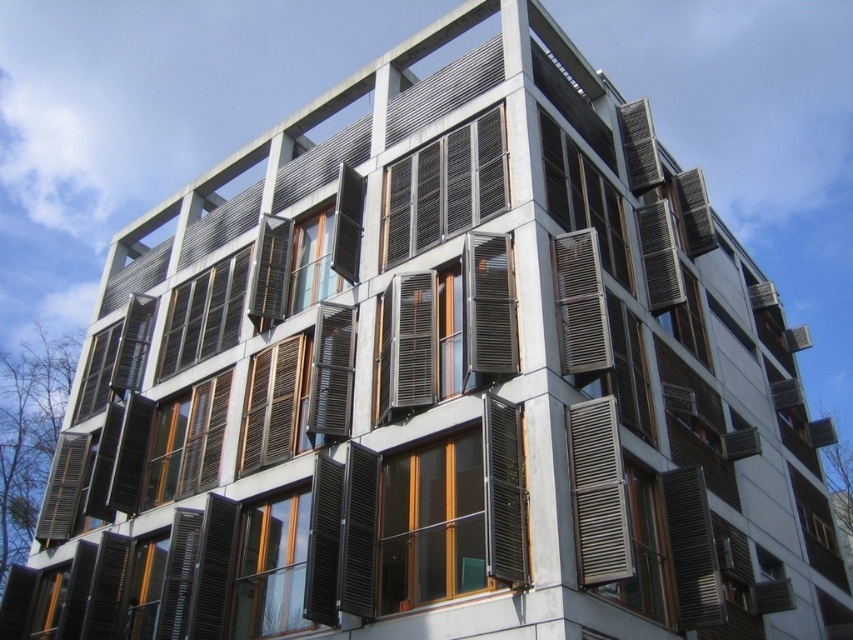
Does matte wood shutter at center have a smaller size compared to metallic silver shutter at center?

No.

Does matte wood shutter at center have a lesser height compared to metallic silver shutter at center?

No, matte wood shutter at center is not shorter than metallic silver shutter at center.

Between point (502, 548) and point (480, 234), which one is positioned in front?

Point (502, 548)

I want to click on matte wood shutter at center, so click(x=503, y=492).

Does metallic silver shutter at lower right appear under metallic silver shutters at center?

Yes, metallic silver shutter at lower right is below metallic silver shutters at center.

Can you confirm if metallic silver shutter at lower right is shorter than metallic silver shutters at center?

No.

Who is more distant from viewer, (599,580) or (560,330)?

Point (560,330)

Locate an element on the screen. metallic silver shutter at lower right is located at coordinates (598, 493).

Is metallic silver shutter at center to the right of metallic silver shutters at center from the viewer's perspective?

No, metallic silver shutter at center is not to the right of metallic silver shutters at center.

Between metallic silver shutter at center and metallic silver shutters at center, which one is positioned lower?

metallic silver shutters at center is lower down.

Which is behind, point (505, 276) or point (576, 323)?

The point (505, 276) is behind.

The width and height of the screenshot is (853, 640). In order to click on metallic silver shutter at center in this screenshot , I will do `click(488, 305)`.